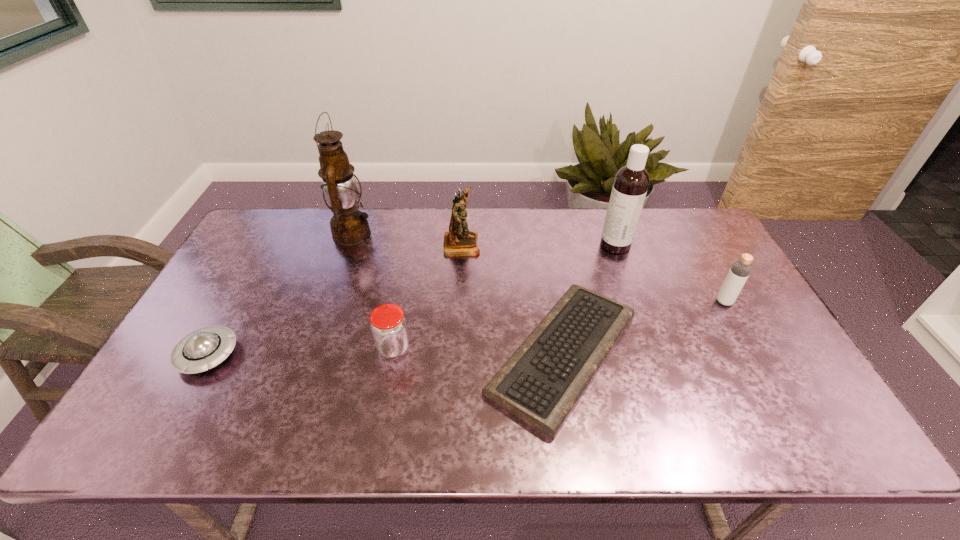
Identify which object is the fifth closest to the tallest object. Please provide its 2D coordinates. Your answer should be formatted as a tuple, i.e. [(x, y)], where the tuple contains the x and y coordinates of a point satisfying the conditions above.

[(631, 182)]

Identify the location of the sixth closest object to the bottle. point(204,348).

Find the location of a particular element. vacant region that satisfies the following two spatial constraints: 1. on the front side of the tallest object; 2. on the left side of the fifth tallest object is located at coordinates (313, 348).

Where is `vacant space that satisfies the following two spatial constraints: 1. on the back side of the fourth shortest object; 2. on the front-facing side of the figurine`? Image resolution: width=960 pixels, height=540 pixels. vacant space that satisfies the following two spatial constraints: 1. on the back side of the fourth shortest object; 2. on the front-facing side of the figurine is located at coordinates (692, 244).

Find the location of a particular element. This screenshot has width=960, height=540. vacant point that satisfies the following two spatial constraints: 1. on the label side of the dishwasher detergent; 2. on the left side of the bottle is located at coordinates (636, 302).

Identify the location of vacant space that satisfies the following two spatial constraints: 1. on the label side of the dishwasher detergent; 2. on the right side of the fourth shortest object. (636, 302).